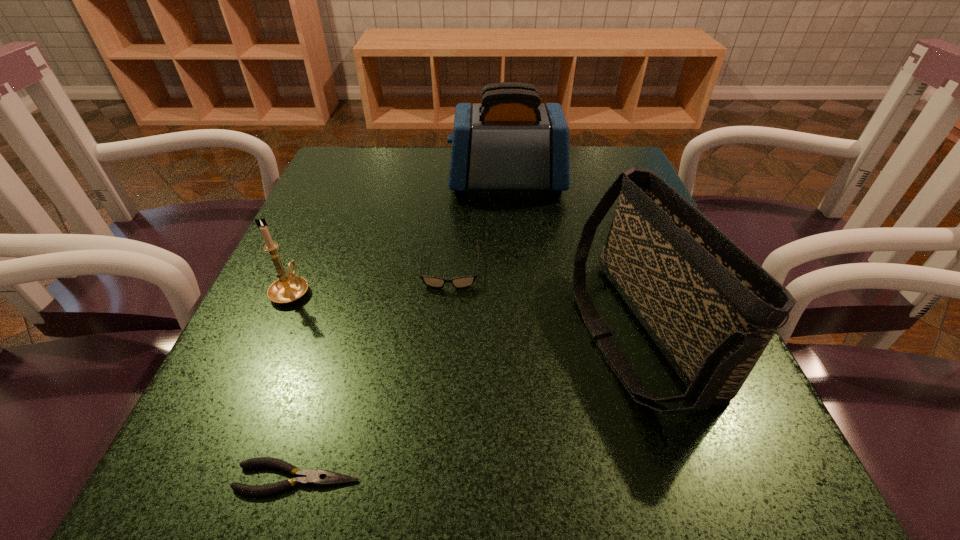
In order to click on free space between the second shortest object and the handbag in this screenshot , I will do `click(545, 301)`.

This screenshot has width=960, height=540. I want to click on object that can be found as the fourth closest to the second object from left to right, so click(x=510, y=141).

Locate which object ranks second in proximity to the leftmost object. Please provide its 2D coordinates. Your answer should be formatted as a tuple, i.e. [(x, y)], where the tuple contains the x and y coordinates of a point satisfying the conditions above.

[(307, 477)]

This screenshot has width=960, height=540. What are the coordinates of `free spot that satisfies the following two spatial constraints: 1. on the front-facing side of the handbag; 2. on the right side of the sunglasses` in the screenshot? It's located at (445, 332).

Where is `vacant space that satisfies the following two spatial constraints: 1. on the front-facing side of the farthest object; 2. on the front-facing side of the sunglasses`? Image resolution: width=960 pixels, height=540 pixels. vacant space that satisfies the following two spatial constraints: 1. on the front-facing side of the farthest object; 2. on the front-facing side of the sunglasses is located at coordinates (514, 269).

Identify the location of vacant area that satisfies the following two spatial constraints: 1. on the front-facing side of the handbag; 2. on the right side of the sunglasses. The height and width of the screenshot is (540, 960). (445, 332).

The height and width of the screenshot is (540, 960). I want to click on vacant position in the image that satisfies the following two spatial constraints: 1. on the front-facing side of the toaster; 2. on the back side of the handbag, so click(x=519, y=332).

Where is `vacant space that satisfies the following two spatial constraints: 1. on the front-facing side of the handbag; 2. on the right side of the sunglasses`? This screenshot has height=540, width=960. vacant space that satisfies the following two spatial constraints: 1. on the front-facing side of the handbag; 2. on the right side of the sunglasses is located at coordinates (445, 332).

Where is `vacant space that satisfies the following two spatial constraints: 1. on the front-facing side of the toaster; 2. on the front-facing side of the fourth tallest object`? vacant space that satisfies the following two spatial constraints: 1. on the front-facing side of the toaster; 2. on the front-facing side of the fourth tallest object is located at coordinates (514, 269).

I want to click on vacant space that satisfies the following two spatial constraints: 1. on the front-facing side of the second shortest object; 2. on the right side of the handbag, so 445,332.